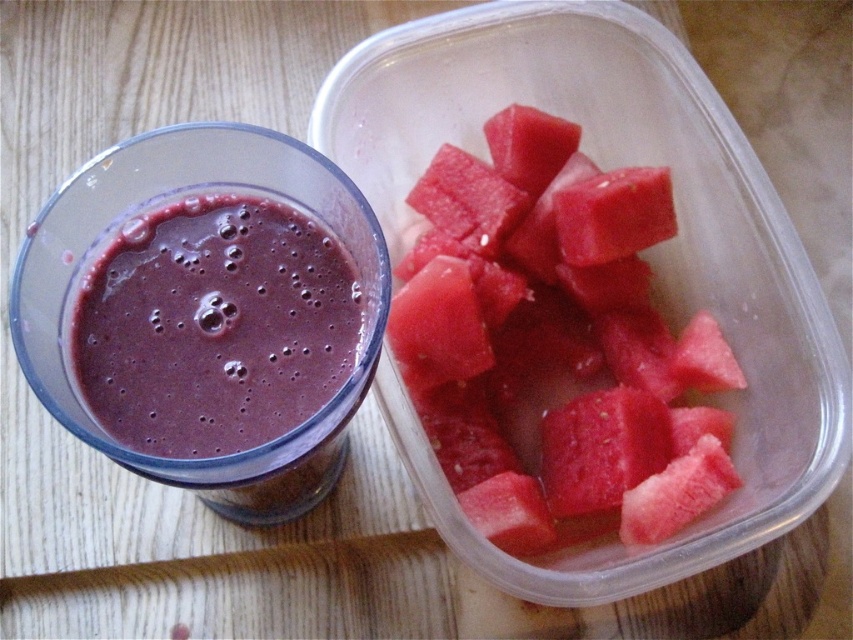
Question: Is red matte watermelon at upper right further to camera compared to purple smoothie at left?

Choices:
 (A) no
 (B) yes

Answer: (B)

Question: Which point is farther to the camera?

Choices:
 (A) purple smoothie at left
 (B) red matte watermelon at upper right

Answer: (B)

Question: Which object appears closest to the camera in this image?

Choices:
 (A) red matte watermelon at upper right
 (B) purple smoothie at left

Answer: (B)

Question: Which point is closer to the camera?

Choices:
 (A) (122, 412)
 (B) (647, 349)

Answer: (A)

Question: Does red matte watermelon at upper right have a smaller size compared to purple smoothie at left?

Choices:
 (A) no
 (B) yes

Answer: (A)

Question: Does red matte watermelon at upper right appear under purple smoothie at left?

Choices:
 (A) no
 (B) yes

Answer: (A)